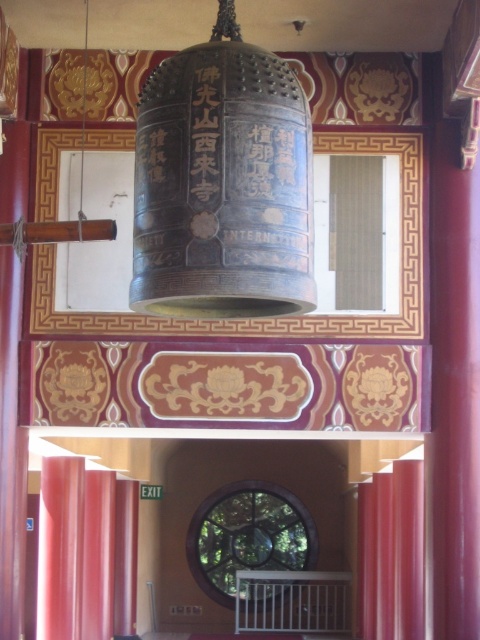
Question: Is matte red curtain at lower left below matte red curtain at right?

Choices:
 (A) no
 (B) yes

Answer: (A)

Question: Does matte red curtain at lower left come in front of matte red curtain at right?

Choices:
 (A) yes
 (B) no

Answer: (A)

Question: Can you confirm if matte red curtain at lower left is wider than matte red curtain at right?

Choices:
 (A) no
 (B) yes

Answer: (B)

Question: Which of the following is the farthest from the observer?

Choices:
 (A) (61, 580)
 (B) (368, 522)

Answer: (B)

Question: Which point is farther from the camera taking this photo?

Choices:
 (A) (56, 525)
 (B) (369, 493)

Answer: (B)

Question: Which point is farther from the camera taking this photo?

Choices:
 (A) (375, 481)
 (B) (94, 554)

Answer: (A)